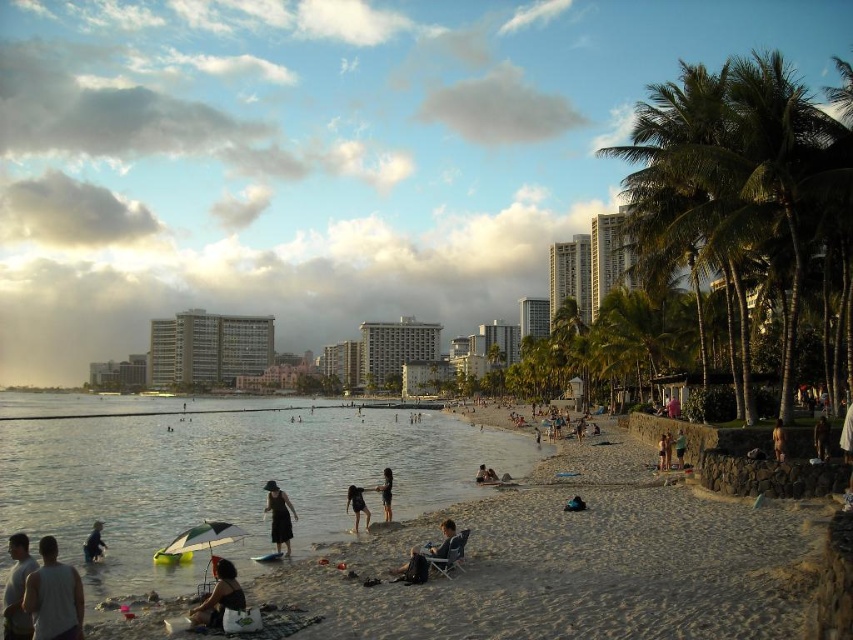
Question: Which of the following is the closest to the observer?

Choices:
 (A) matte black chair at lower center
 (B) white tank top at lower left
 (C) dark blue fabric at lower left
 (D) black matte dress at center

Answer: (B)

Question: Does green leafy palm tree at right appear on the right side of light brown fabric shirt at lower left?

Choices:
 (A) no
 (B) yes

Answer: (B)

Question: From the image, what is the correct spatial relationship of white tank top at lower left in relation to matte black chair at lower center?

Choices:
 (A) right
 (B) left

Answer: (B)

Question: Does light brown fabric shirt at lower left come behind matte black chair at lower center?

Choices:
 (A) no
 (B) yes

Answer: (A)

Question: Which object appears closest to the camera in this image?

Choices:
 (A) dark blue fabric at center
 (B) dark blue fabric at lower left
 (C) green leafy palm tree at right

Answer: (B)

Question: Which of the following is the farthest from the observer?

Choices:
 (A) gray concrete building at center
 (B) dark blue fabric at lower left

Answer: (A)